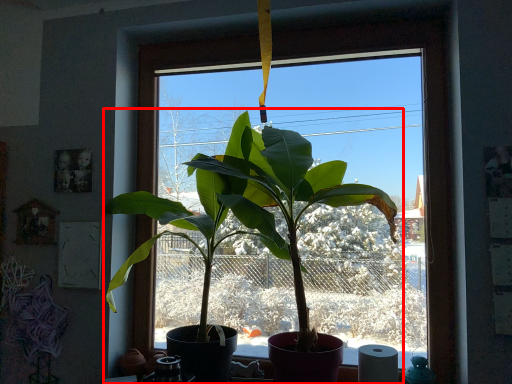
Question: From the image's perspective, what is the correct spatial positioning of houseplant (annotated by the red box) in reference to toilet paper?

Choices:
 (A) above
 (B) below

Answer: (A)